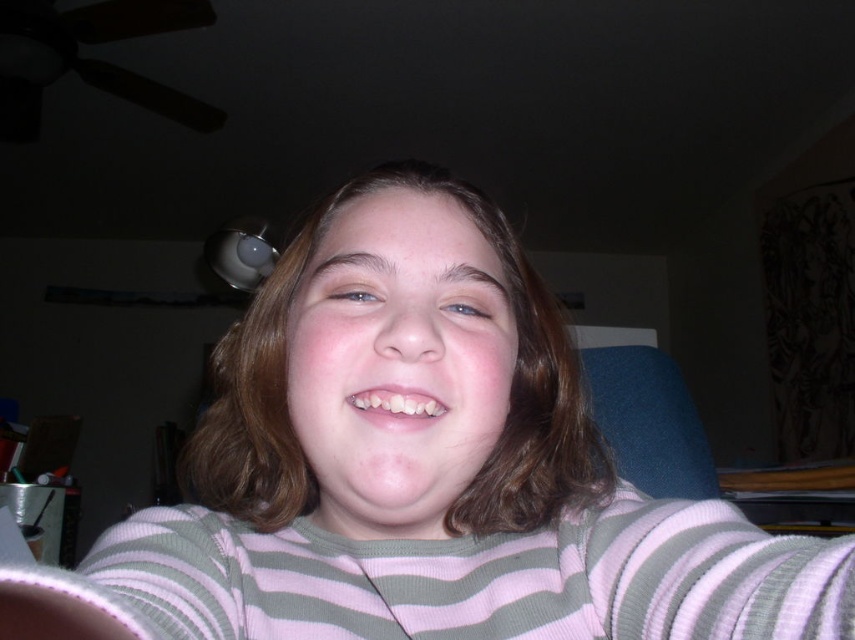
Between pink striped sweater at center and white glossy teeth at center, which one is positioned higher?

white glossy teeth at center

Between point (641, 516) and point (391, 396), which one is positioned in front?

Point (391, 396) is in front.

Is point (500, 216) positioned behind point (417, 397)?

Yes, point (500, 216) is behind point (417, 397).

Find the location of a particular element. This screenshot has width=855, height=640. pink striped sweater at center is located at coordinates (420, 472).